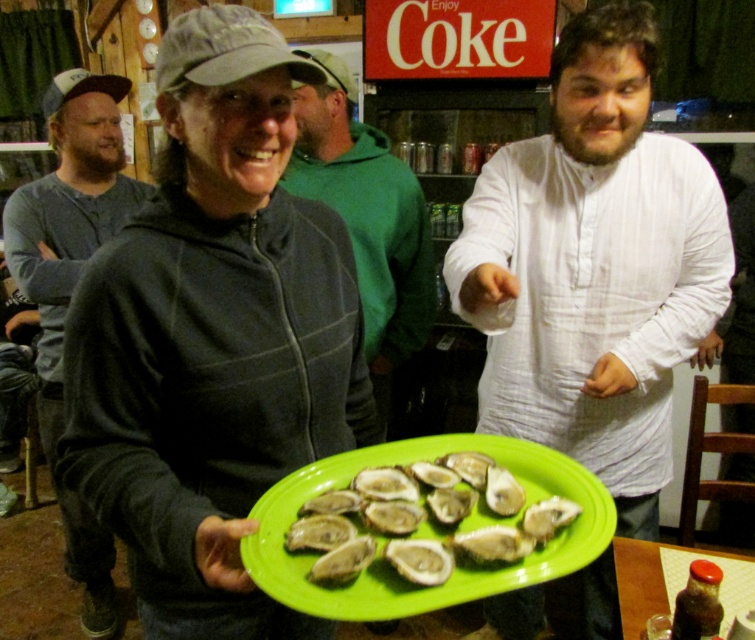
Question: Can you confirm if white textured shirt at center is positioned below green matte oyster at center?

Choices:
 (A) no
 (B) yes

Answer: (B)

Question: Is matte gray hoodie at center behind gray cotton shirt at left?

Choices:
 (A) no
 (B) yes

Answer: (A)

Question: Which object appears closest to the camera in this image?

Choices:
 (A) green matte oyster at center
 (B) matte gray hoodie at center
 (C) green fleece hoodie at center
 (D) gray cotton shirt at left

Answer: (B)

Question: Can you confirm if matte gray hoodie at center is positioned below green fleece hoodie at center?

Choices:
 (A) no
 (B) yes

Answer: (B)

Question: Which of the following is the closest to the observer?

Choices:
 (A) gray cotton shirt at left
 (B) white textured shirt at center

Answer: (B)

Question: Based on their relative distances, which object is nearer to the green matte oyster at center?

Choices:
 (A) white textured shirt at center
 (B) gray cotton shirt at left
 (C) matte gray hoodie at center

Answer: (C)